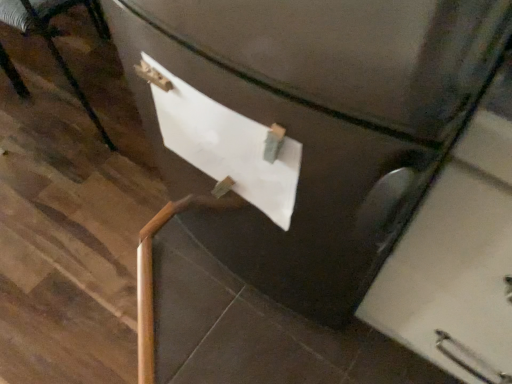
Question: Should I look upward or downward to see brushed metal chair at lower left?

Choices:
 (A) down
 (B) up

Answer: (B)

Question: Considering the relative positions of white matte paper at center and brushed metal chair at lower left in the image provided, is white matte paper at center to the left of brushed metal chair at lower left from the viewer's perspective?

Choices:
 (A) yes
 (B) no

Answer: (B)

Question: Is white matte paper at center oriented towards brushed metal chair at lower left?

Choices:
 (A) no
 (B) yes

Answer: (A)

Question: Can you confirm if white matte paper at center is shorter than brushed metal chair at lower left?

Choices:
 (A) no
 (B) yes

Answer: (B)

Question: Is white matte paper at center taller than brushed metal chair at lower left?

Choices:
 (A) no
 (B) yes

Answer: (A)

Question: From a real-world perspective, is white matte paper at center located higher than brushed metal chair at lower left?

Choices:
 (A) no
 (B) yes

Answer: (B)

Question: Is white matte paper at center completely or partially outside of brushed metal chair at lower left?

Choices:
 (A) yes
 (B) no

Answer: (A)

Question: Is brushed metal chair at lower left facing towards white matte paper at center?

Choices:
 (A) yes
 (B) no

Answer: (A)

Question: Is brushed metal chair at lower left further to the viewer compared to white matte paper at center?

Choices:
 (A) no
 (B) yes

Answer: (B)

Question: Is white matte paper at center inside brushed metal chair at lower left?

Choices:
 (A) yes
 (B) no

Answer: (B)

Question: Is brushed metal chair at lower left to the right of white matte paper at center from the viewer's perspective?

Choices:
 (A) no
 (B) yes

Answer: (A)

Question: Can you confirm if brushed metal chair at lower left is taller than white matte paper at center?

Choices:
 (A) no
 (B) yes

Answer: (B)

Question: Does brushed metal chair at lower left have a lesser width compared to white matte paper at center?

Choices:
 (A) yes
 (B) no

Answer: (B)

Question: From the image's perspective, is white matte paper at center positioned above or below brushed metal chair at lower left?

Choices:
 (A) above
 (B) below

Answer: (B)